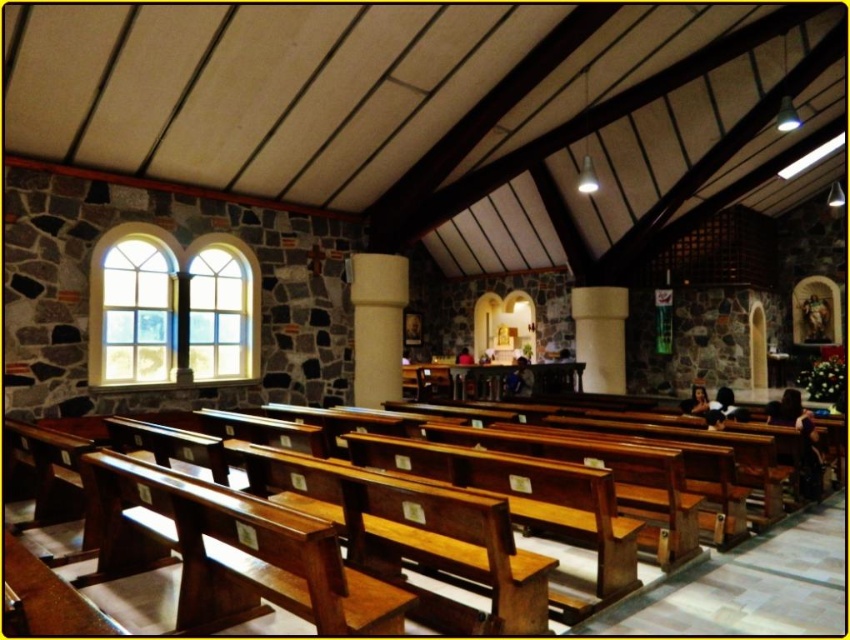
Question: Is clear glass window at upper left thinner than white smooth pillar at center?

Choices:
 (A) yes
 (B) no

Answer: (B)

Question: Which point is farther to the camera?

Choices:
 (A) (584, 296)
 (B) (370, 307)

Answer: (A)

Question: Among these objects, which one is farthest from the camera?

Choices:
 (A) clear glass window at upper left
 (B) white smooth column at center
 (C) white smooth pillar at center

Answer: (C)

Question: Is white smooth column at center smaller than white smooth pillar at center?

Choices:
 (A) yes
 (B) no

Answer: (A)

Question: Does clear glass window at upper left have a smaller size compared to white smooth column at center?

Choices:
 (A) yes
 (B) no

Answer: (B)

Question: Considering the real-world distances, which object is closest to the white smooth column at center?

Choices:
 (A) wooden bench at center
 (B) white smooth pillar at center
 (C) clear glass window at upper left

Answer: (C)